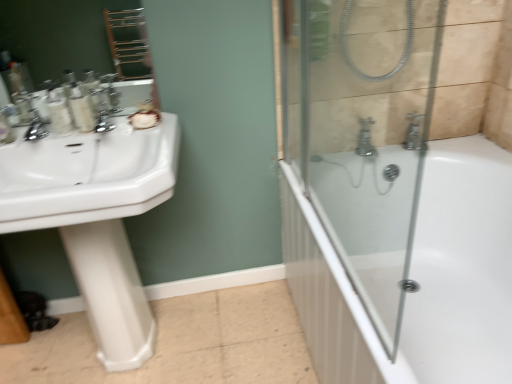
Question: Does matte plastic bottles at left, acting as the first toiletry starting from the right, have a lesser width compared to white glossy pedestal at left?

Choices:
 (A) yes
 (B) no

Answer: (A)

Question: Does matte plastic bottles at left, the second toiletry positioned from the left, appear on the left side of white glossy pedestal at left?

Choices:
 (A) no
 (B) yes

Answer: (B)

Question: Is matte plastic bottles at left, the second toiletry positioned from the left, shorter than white glossy pedestal at left?

Choices:
 (A) no
 (B) yes

Answer: (B)

Question: Is matte plastic bottles at left, acting as the first toiletry starting from the right, not inside white glossy pedestal at left?

Choices:
 (A) no
 (B) yes

Answer: (B)

Question: From the image's perspective, is matte plastic bottles at left, the second toiletry positioned from the left, beneath white glossy pedestal at left?

Choices:
 (A) yes
 (B) no

Answer: (B)

Question: Is matte plastic bottles at left, the second toiletry positioned from the left, facing towards white glossy pedestal at left?

Choices:
 (A) no
 (B) yes

Answer: (A)

Question: Is white glossy sink at left positioned beyond the bounds of matte plastic bottles at left, the second toiletry positioned from the left?

Choices:
 (A) no
 (B) yes

Answer: (B)

Question: Could you tell me if white glossy sink at left is turned towards matte plastic bottles at left, acting as the first toiletry starting from the right?

Choices:
 (A) yes
 (B) no

Answer: (B)

Question: Does white glossy sink at left have a greater width compared to matte plastic bottles at left, acting as the first toiletry starting from the right?

Choices:
 (A) yes
 (B) no

Answer: (A)

Question: Does white glossy sink at left have a greater height compared to matte plastic bottles at left, acting as the first toiletry starting from the right?

Choices:
 (A) yes
 (B) no

Answer: (A)

Question: Does white glossy sink at left appear on the left side of matte plastic bottles at left, acting as the first toiletry starting from the right?

Choices:
 (A) yes
 (B) no

Answer: (A)

Question: Is white glossy sink at left oriented away from matte plastic bottles at left, acting as the first toiletry starting from the right?

Choices:
 (A) yes
 (B) no

Answer: (B)

Question: Is matte plastic bottles at left, which appears as the first toiletry when viewed from the left, thinner than matte plastic bottles at left, acting as the first toiletry starting from the right?

Choices:
 (A) no
 (B) yes

Answer: (A)